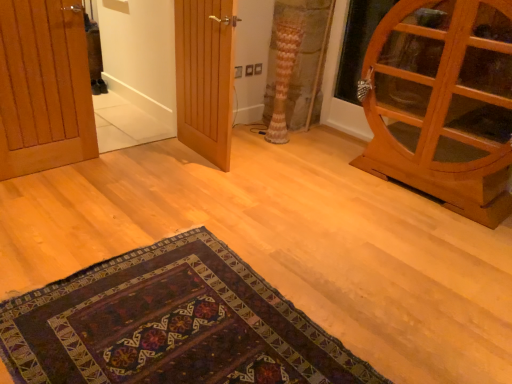
At what (x,y) coordinates should I click in order to perform the action: click on vacant region in front of wooden cabinet at right, which is counted as the 3th door, starting from the left. Please return your answer as a coordinate pair (x, y). Image resolution: width=512 pixels, height=384 pixels. Looking at the image, I should click on (408, 244).